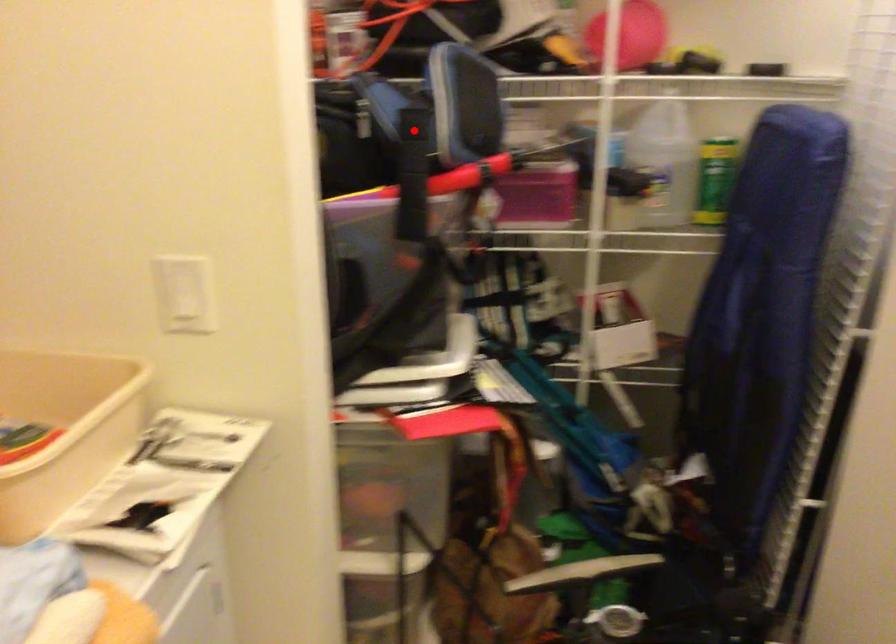
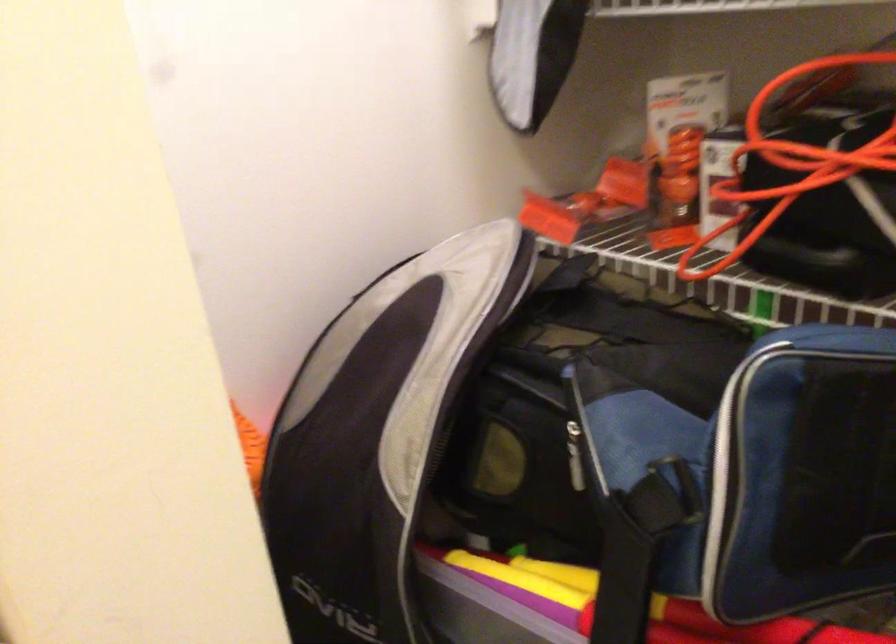
Question: A red point is marked in image1. In image2, is the corresponding 3D point closer to the camera or farther? Reply with the corresponding letter.

Choices:
 (A) The corresponding 3D point is closer.
 (B) The corresponding 3D point is farther.

Answer: (A)